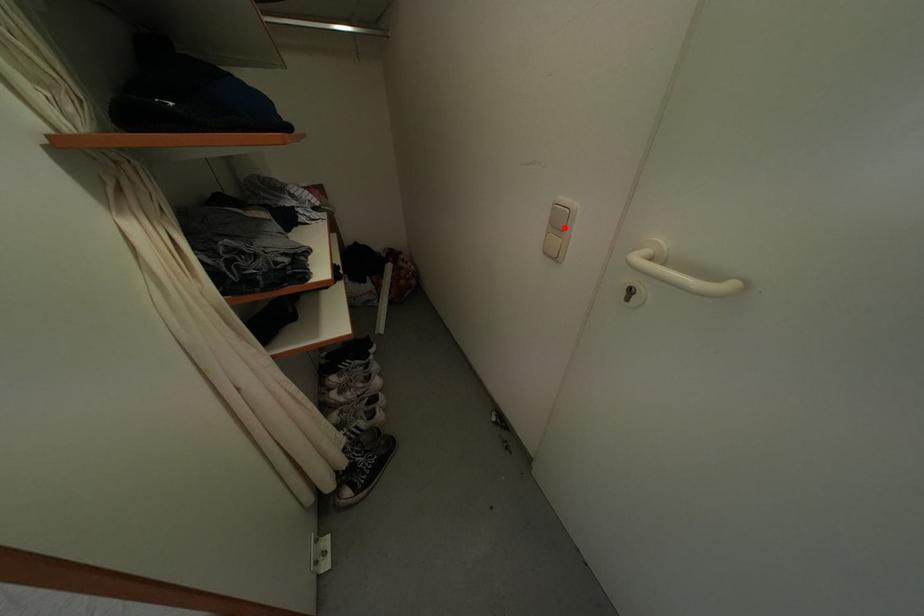
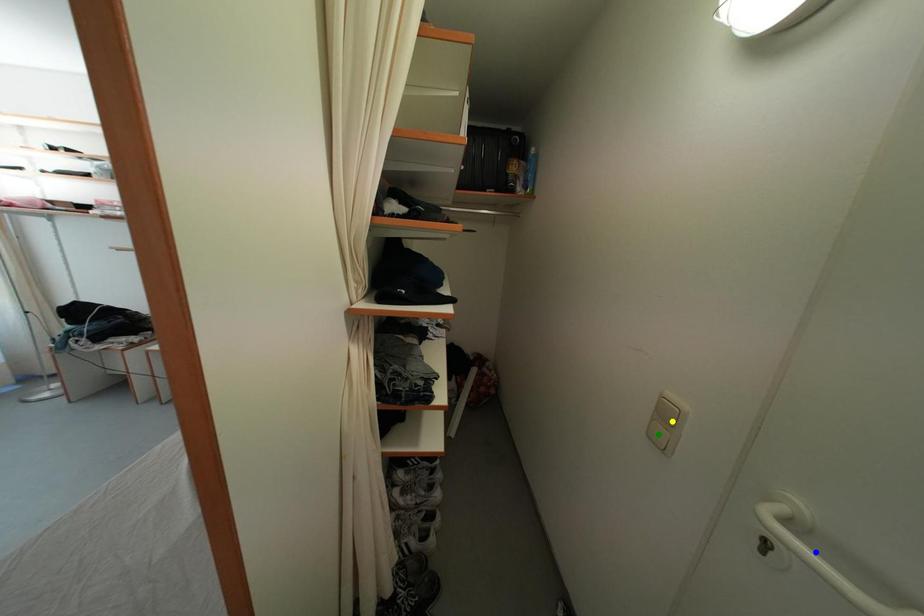
Question: I am providing you with two images of the same scene from different viewpoints. A red point is marked on the first image. You are given multiple points on the second image. Which point in image 2 is actually the same real-world point as the red point in image 1?

Choices:
 (A) green point
 (B) yellow point
 (C) blue point

Answer: (B)